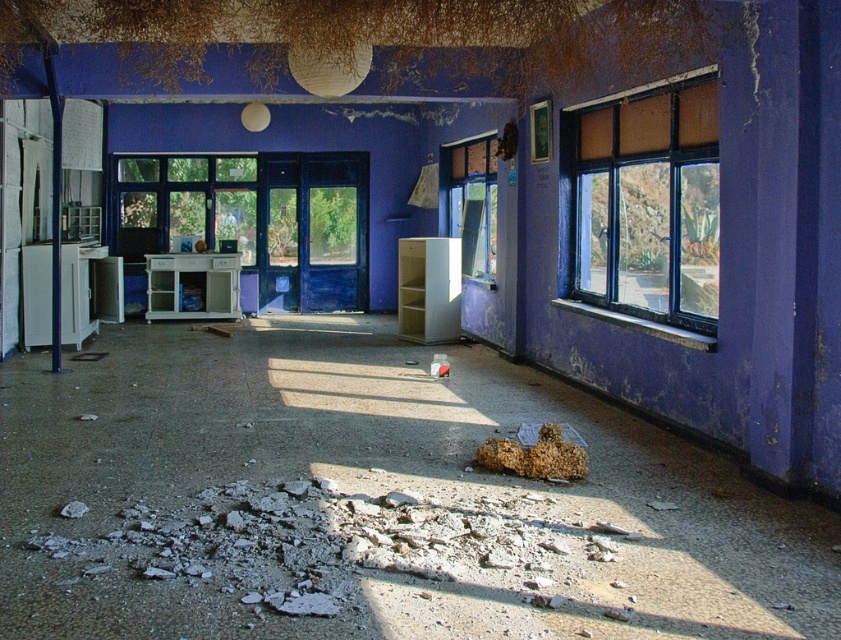
Between matte glass window at right and crumbly brown bread at lower center, which one has more height?

matte glass window at right

Does matte glass window at right have a smaller size compared to crumbly brown bread at lower center?

Incorrect, matte glass window at right is not smaller in size than crumbly brown bread at lower center.

Is point (690, 294) positioned before point (553, 422)?

That is True.

Find the location of `matte glass window at right`. matte glass window at right is located at coordinates (649, 208).

Is matte glass window at right in front of transparent glass window at center?

Yes.

Which is above, matte glass window at right or transparent glass window at center?

transparent glass window at center is higher up.

What do you see at coordinates (649, 208) in the screenshot? The height and width of the screenshot is (640, 841). I see `matte glass window at right` at bounding box center [649, 208].

This screenshot has height=640, width=841. I want to click on matte glass window at right, so click(649, 208).

Is transparent glass window at center above crumbly brown bread at lower center?

Yes.

Is point (461, 179) farther from viewer compared to point (549, 436)?

Yes, it is behind point (549, 436).

At what (x,y) coordinates should I click in order to perform the action: click on transparent glass window at center. Please return your answer as a coordinate pair (x, y). The height and width of the screenshot is (640, 841). Looking at the image, I should click on (472, 202).